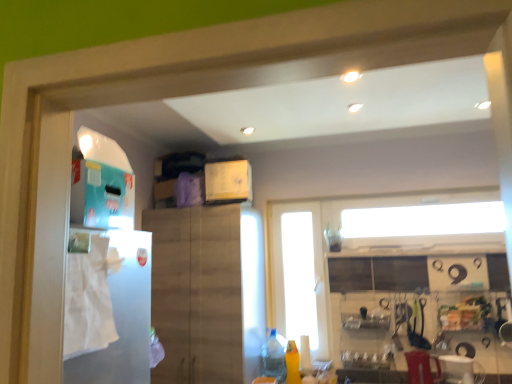
How much space does yellow matte bottle at lower center, which is the 1th bottle from right to left, occupy vertically?

It is 13.97 inches.

Locate an element on the screen. The height and width of the screenshot is (384, 512). wooden cabinet at center is located at coordinates (206, 293).

Where is `transparent glass door at center`? This screenshot has width=512, height=384. transparent glass door at center is located at coordinates (298, 275).

Identify the location of yellow matte bottle at lower center, the 2th bottle positioned from the left. (292, 363).

Is yellow matte bottle at lower center, which is the 1th bottle from right to left, closer to camera compared to white paper towel at left?

That is False.

Which is more to the left, yellow matte bottle at lower center, the 2th bottle positioned from the left, or white paper towel at left?

Positioned to the left is white paper towel at left.

Between yellow matte bottle at lower center, which is the 1th bottle from right to left, and white paper towel at left, which one has smaller size?

yellow matte bottle at lower center, which is the 1th bottle from right to left, is smaller.

Between yellow matte bottle at lower center, which is the 1th bottle from right to left, and wooden cabinet at center, which one has less height?

yellow matte bottle at lower center, which is the 1th bottle from right to left, is shorter.

Is yellow matte bottle at lower center, the 2th bottle positioned from the left, facing away from wooden cabinet at center?

yellow matte bottle at lower center, the 2th bottle positioned from the left, is not turned away from wooden cabinet at center.

From a real-world perspective, is yellow matte bottle at lower center, the 2th bottle positioned from the left, positioned above or below wooden cabinet at center?

Clearly, from a real-world perspective, yellow matte bottle at lower center, the 2th bottle positioned from the left, is below wooden cabinet at center.

Is wooden cabinet at center surrounded by yellow matte bottle at lower center, the 2th bottle positioned from the left?

No, wooden cabinet at center is located outside of yellow matte bottle at lower center, the 2th bottle positioned from the left.

How much distance is there between white paper towel at left and yellow matte bottle at lower center, which is the 1th bottle from right to left?

white paper towel at left and yellow matte bottle at lower center, which is the 1th bottle from right to left, are 1.86 meters apart.

Does white paper towel at left have a larger size compared to yellow matte bottle at lower center, which is the 1th bottle from right to left?

Correct, white paper towel at left is larger in size than yellow matte bottle at lower center, which is the 1th bottle from right to left.

Which of these two, white paper towel at left or yellow matte bottle at lower center, the 2th bottle positioned from the left, stands shorter?

white paper towel at left is shorter.

From a real-world perspective, is white paper towel at left above or below yellow matte bottle at lower center, the 2th bottle positioned from the left?

In terms of real-world spatial position, white paper towel at left is above yellow matte bottle at lower center, the 2th bottle positioned from the left.

Is yellow matte bottle at lower center, which is the 1th bottle from right to left, facing away from clear plastic bottle at lower center, positioned as the 2th bottle in right-to-left order?

No, yellow matte bottle at lower center, which is the 1th bottle from right to left, is not facing the opposite direction of clear plastic bottle at lower center, positioned as the 2th bottle in right-to-left order.

Could clear plastic bottle at lower center, the first bottle viewed from the left, be considered to be inside yellow matte bottle at lower center, which is the 1th bottle from right to left?

No, clear plastic bottle at lower center, the first bottle viewed from the left, is located outside of yellow matte bottle at lower center, which is the 1th bottle from right to left.

From the image's perspective, which is below, yellow matte bottle at lower center, the 2th bottle positioned from the left, or clear plastic bottle at lower center, positioned as the 2th bottle in right-to-left order?

clear plastic bottle at lower center, positioned as the 2th bottle in right-to-left order, is shown below in the image.

Does wooden cabinet at center have a greater width compared to transparent glass door at center?

Correct, the width of wooden cabinet at center exceeds that of transparent glass door at center.

Is wooden cabinet at center facing towards transparent glass door at center?

No, wooden cabinet at center is not facing towards transparent glass door at center.

Is wooden cabinet at center taller than transparent glass door at center?

Correct, wooden cabinet at center is much taller as transparent glass door at center.

Find the location of a particular element. The image size is (512, 384). glass door on the right of wooden cabinet at center is located at coordinates (298, 275).

Is white plastic blender at lower right oriented away from yellow matte bottle at lower center, which is the 1th bottle from right to left?

No, white plastic blender at lower right is not facing away from yellow matte bottle at lower center, which is the 1th bottle from right to left.

From a real-world perspective, is white plastic blender at lower right on yellow matte bottle at lower center, the 2th bottle positioned from the left?

No, from a real-world perspective, white plastic blender at lower right is not on top of yellow matte bottle at lower center, the 2th bottle positioned from the left.

Is white plastic blender at lower right next to yellow matte bottle at lower center, which is the 1th bottle from right to left?

white plastic blender at lower right and yellow matte bottle at lower center, which is the 1th bottle from right to left, are clearly separated.

Would you say white plastic blender at lower right is inside or outside yellow matte bottle at lower center, which is the 1th bottle from right to left?

white plastic blender at lower right exists outside the volume of yellow matte bottle at lower center, which is the 1th bottle from right to left.

Is point (290, 220) positioned after point (160, 223)?

Yes, it is behind point (160, 223).

The image size is (512, 384). Identify the location of glass door above the wooden cabinet at center (from a real-world perspective). (298, 275).

Which object is positioned more to the right, transparent glass door at center or wooden cabinet at center?

From the viewer's perspective, transparent glass door at center appears more on the right side.

Is transparent glass door at center in front of wooden cabinet at center?

No, it is not.

I want to click on fridge above the yellow matte bottle at lower center, which is the 1th bottle from right to left (from a real-world perspective), so click(x=122, y=318).

The image size is (512, 384). In order to click on the 2nd bottle counting from the right side of the wooden cabinet at center in this screenshot , I will do `click(292, 363)`.

Estimate the real-world distances between objects in this image. Which object is further from white paper towel at left, clear plastic bottle at lower center, positioned as the 2th bottle in right-to-left order, or wooden cabinet at center?

clear plastic bottle at lower center, positioned as the 2th bottle in right-to-left order, is positioned further to the anchor white paper towel at left.

Considering their positions, is transparent glass door at center positioned further to yellow matte bottle at lower center, the 2th bottle positioned from the left, than wooden cabinet at center?

wooden cabinet at center is further to yellow matte bottle at lower center, the 2th bottle positioned from the left.

Based on their spatial positions, is wooden cabinet at center or clear plastic bottle at lower center, positioned as the 2th bottle in right-to-left order, closer to yellow matte bottle at lower center, which is the 1th bottle from right to left?

The object closer to yellow matte bottle at lower center, which is the 1th bottle from right to left, is clear plastic bottle at lower center, positioned as the 2th bottle in right-to-left order.

Based on the photo, when comparing their distances from yellow matte bottle at lower center, the 2th bottle positioned from the left, does transparent glass door at center or white paper towel at left seem closer?

transparent glass door at center lies closer to yellow matte bottle at lower center, the 2th bottle positioned from the left, than the other object.

Considering their positions, is white paper towel at left positioned closer to white plastic blender at lower right than transparent glass door at center?

Among the two, transparent glass door at center is located nearer to white plastic blender at lower right.

When comparing their distances from clear plastic bottle at lower center, positioned as the 2th bottle in right-to-left order, does transparent glass door at center or wooden cabinet at center seem further?

wooden cabinet at center.

When comparing their distances from yellow matte bottle at lower center, which is the 1th bottle from right to left, does white plastic blender at lower right or wooden cabinet at center seem closer?

The object closer to yellow matte bottle at lower center, which is the 1th bottle from right to left, is wooden cabinet at center.

Which object lies nearer to the anchor point clear plastic bottle at lower center, the first bottle viewed from the left, yellow matte bottle at lower center, which is the 1th bottle from right to left, or white paper towel at left?

yellow matte bottle at lower center, which is the 1th bottle from right to left.

This screenshot has height=384, width=512. What are the coordinates of `bottle located between wooden cabinet at center and yellow matte bottle at lower center, the 2th bottle positioned from the left, in the left-right direction` in the screenshot? It's located at (274, 357).

Locate an element on the screen. cabinetry located between white paper towel at left and transparent glass door at center in the depth direction is located at coordinates (206, 293).

The width and height of the screenshot is (512, 384). I want to click on appliance located between white paper towel at left and transparent glass door at center in the depth direction, so click(461, 369).

Identify the location of bottle between transparent glass door at center and clear plastic bottle at lower center, positioned as the 2th bottle in right-to-left order, from top to bottom. This screenshot has width=512, height=384. (292, 363).